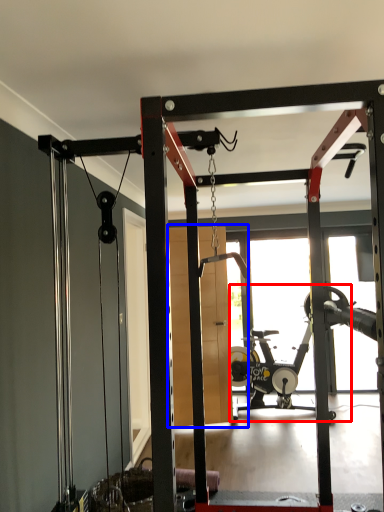
Question: Which object appears farthest to the camera in this image, stationary bicycle (highlighted by a red box) or garage door (highlighted by a blue box)?

Choices:
 (A) stationary bicycle
 (B) garage door

Answer: (A)